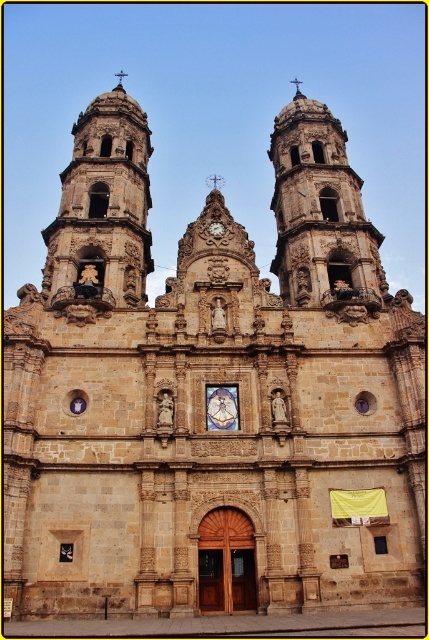
Question: Which object is the closest to the gold ornate clock at center?

Choices:
 (A) brown stone tower at left
 (B) stone tower at center

Answer: (A)

Question: Does stone tower at center have a lesser width compared to gold ornate clock at center?

Choices:
 (A) yes
 (B) no

Answer: (B)

Question: Is stone tower at center further to the viewer compared to gold ornate clock at center?

Choices:
 (A) no
 (B) yes

Answer: (A)

Question: Based on their relative distances, which object is nearer to the gold ornate clock at center?

Choices:
 (A) stone tower at center
 (B) brown stone tower at left

Answer: (B)

Question: Considering the real-world distances, which object is farthest from the brown stone tower at left?

Choices:
 (A) gold ornate clock at center
 (B) stone tower at center

Answer: (B)

Question: Is brown stone tower at left bigger than gold ornate clock at center?

Choices:
 (A) no
 (B) yes

Answer: (B)